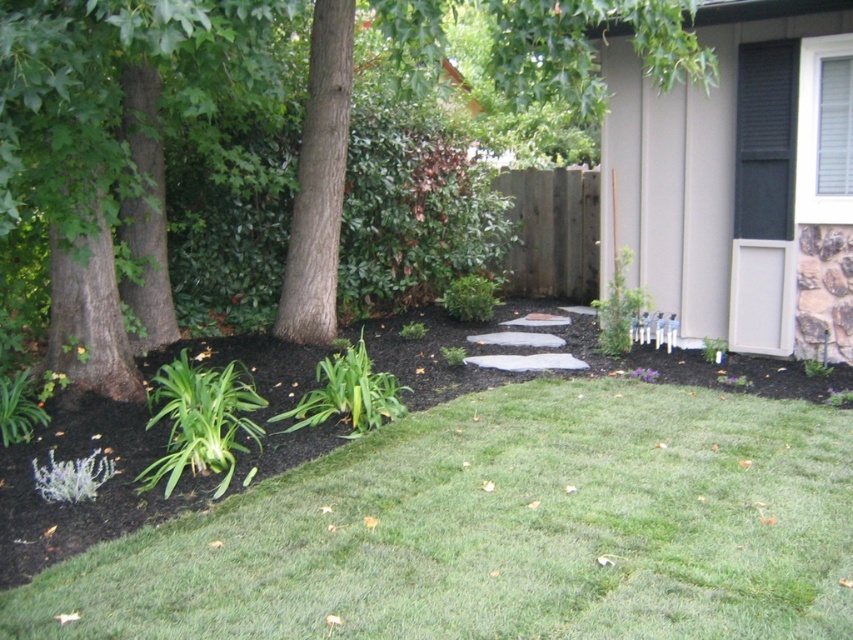
Which is more to the left, green soft grass at lower center or green leafy plant at center?

green leafy plant at center

Is green soft grass at lower center further to the viewer compared to green leafy plant at center?

That is False.

This screenshot has width=853, height=640. I want to click on green soft grass at lower center, so click(x=502, y=531).

Which is more to the left, brown textured tree at center or green leafy plant at center?

brown textured tree at center is more to the left.

At what (x,y) coordinates should I click in order to perform the action: click on brown textured tree at center. Please return your answer as a coordinate pair (x, y). Looking at the image, I should click on (108, 134).

Can you confirm if green soft grass at lower center is positioned to the left of brown textured tree at center?

No, green soft grass at lower center is not to the left of brown textured tree at center.

Is point (595, 456) closer to viewer compared to point (236, 17)?

No, it is behind (236, 17).

This screenshot has height=640, width=853. I want to click on green soft grass at lower center, so click(502, 531).